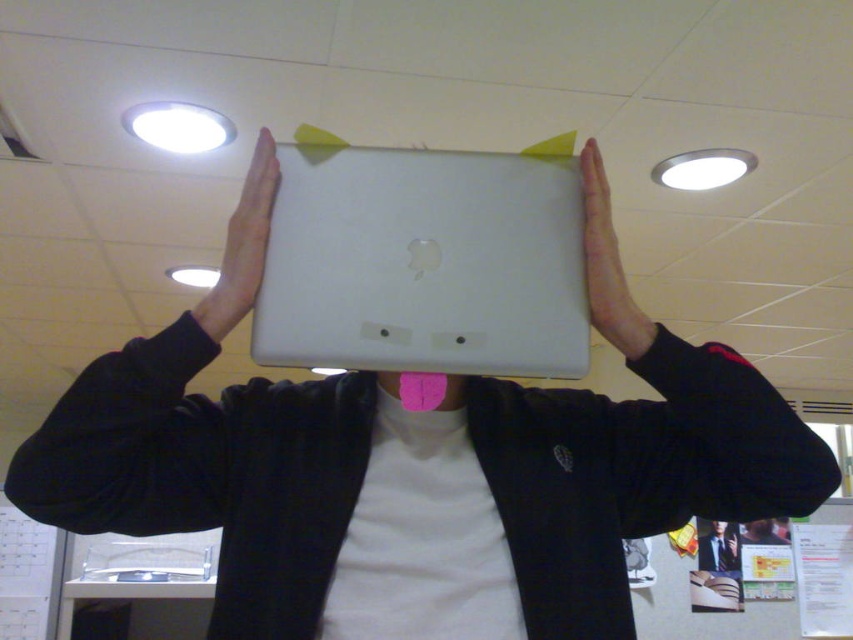
Question: Which point is farther from the camera taking this photo?

Choices:
 (A) (221, 296)
 (B) (624, 314)
 (C) (390, 332)

Answer: (B)

Question: Does satin white laptop at center appear over pink matte tongue at center?

Choices:
 (A) yes
 (B) no

Answer: (B)

Question: Which point is closer to the camera?

Choices:
 (A) (263, 225)
 (B) (646, 330)
 (C) (392, 253)

Answer: (C)

Question: Is pink matte tongue at center smaller than white matte laptop at center?

Choices:
 (A) yes
 (B) no

Answer: (A)

Question: Which is farther from the satin white laptop at center?

Choices:
 (A) white matte laptop at center
 (B) pink matte tongue at center

Answer: (A)

Question: Does satin white laptop at center have a smaller size compared to white matte laptop at center?

Choices:
 (A) no
 (B) yes

Answer: (A)